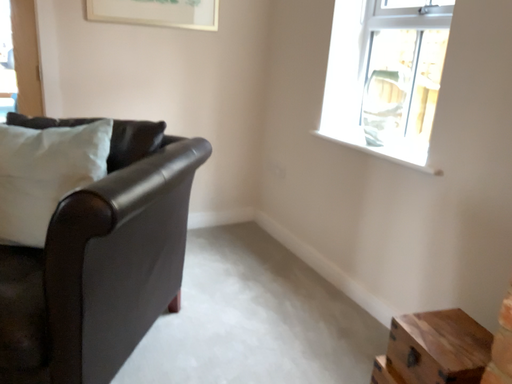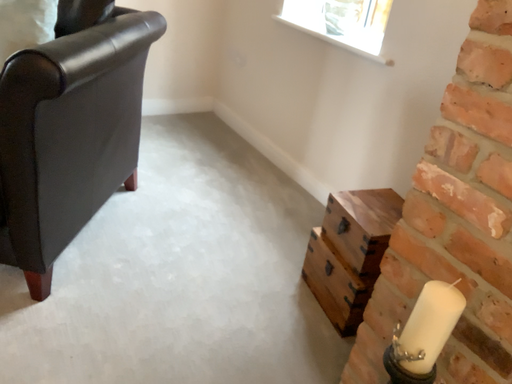
Question: How did the camera likely rotate when shooting the video?

Choices:
 (A) rotated upward
 (B) rotated downward

Answer: (B)